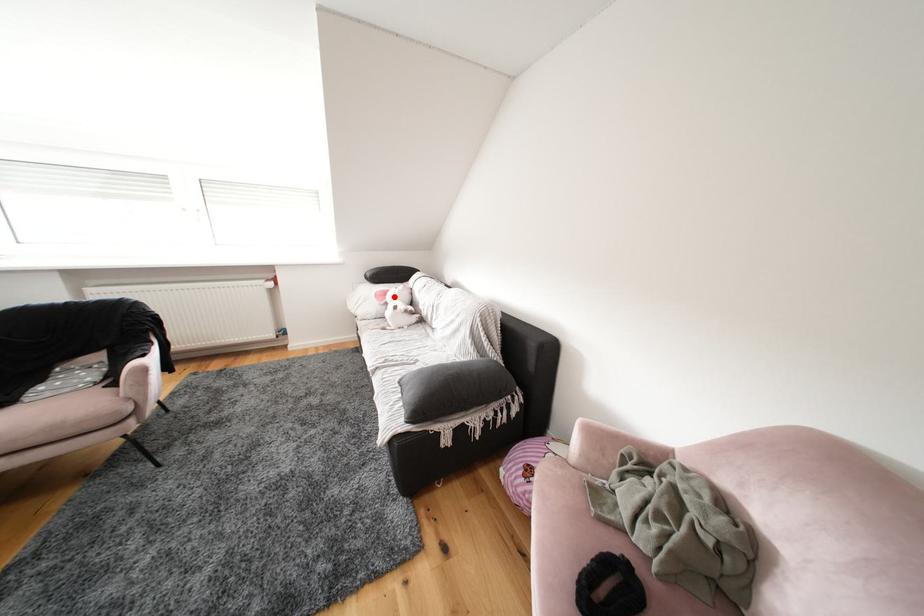
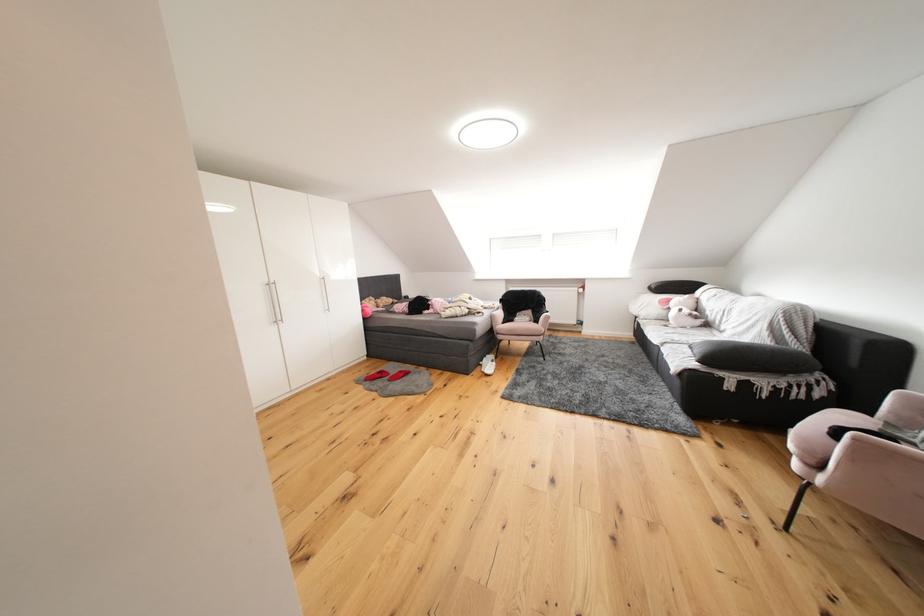
Locate, in the second image, the point that corresponds to the highlighted location in the first image.

(677, 305)